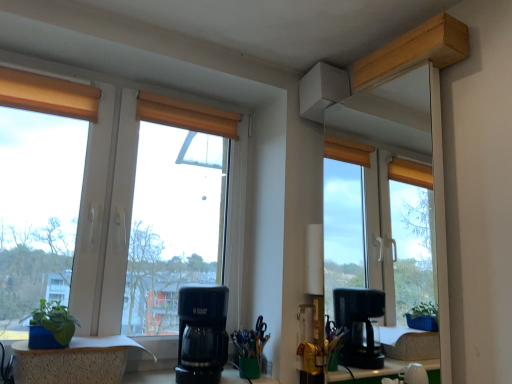
Question: Relative to blue textured planter at lower left, the first window in the bottom-to-top sequence, is black plastic coffee maker at center in front or behind?

Choices:
 (A) front
 (B) behind

Answer: (B)

Question: Is black plastic coffee maker at center taller or shorter than blue textured planter at lower left, the first window in the bottom-to-top sequence?

Choices:
 (A) short
 (B) tall

Answer: (B)

Question: Which of these objects is positioned closest to the black plastic coffee maker at center?

Choices:
 (A) green felt houseplant at lower left
 (B) matte glass window at left, which is counted as the first window, starting from the top
 (C) wooden blind at center
 (D) blue textured planter at lower left, the second window positioned from the top

Answer: (D)

Question: Which of these objects is positioned farthest from the matte glass window at left, the second window ordered from the bottom?

Choices:
 (A) wooden blind at center
 (B) blue textured planter at lower left, the first window in the bottom-to-top sequence
 (C) green felt houseplant at lower left
 (D) black plastic coffee maker at center

Answer: (C)